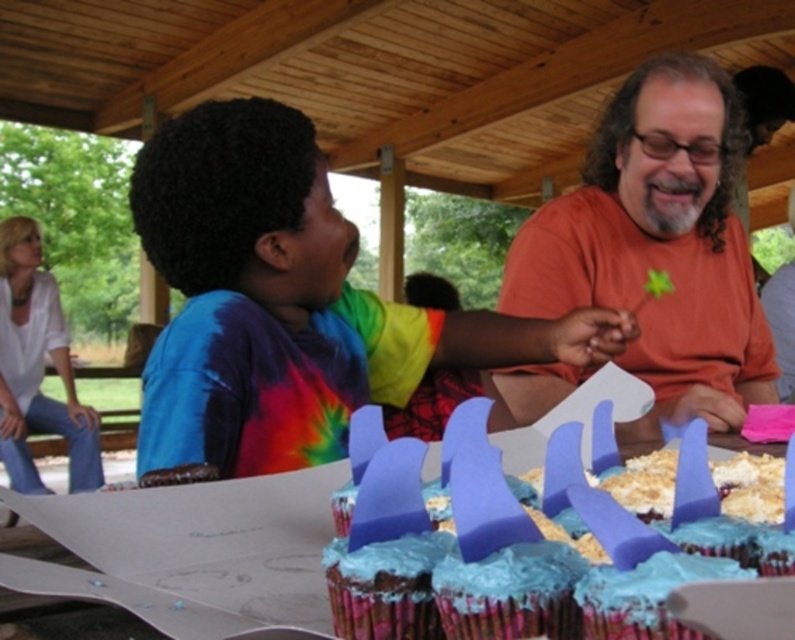
Is orange matte shirt at center in front of blue foam shark fin at center?

No.

Image resolution: width=795 pixels, height=640 pixels. I want to click on orange matte shirt at center, so click(658, 244).

Where is `orange matte shirt at center`? This screenshot has height=640, width=795. orange matte shirt at center is located at coordinates (658, 244).

Where is `orange matte shirt at center`? The height and width of the screenshot is (640, 795). orange matte shirt at center is located at coordinates (658, 244).

Is tie-dye shirt at left wider than orange matte shirt at center?

Yes.

Between tie-dye shirt at left and orange matte shirt at center, which one has less height?

With less height is tie-dye shirt at left.

Between point (272, 460) and point (602, 156), which one is positioned behind?

The point (602, 156) is behind.

In order to click on tie-dye shirt at left in this screenshot , I will do `click(254, 289)`.

Can you confirm if tie-dye shirt at left is positioned to the right of blue foam shark fin at center?

No, tie-dye shirt at left is not to the right of blue foam shark fin at center.

Image resolution: width=795 pixels, height=640 pixels. What do you see at coordinates (254, 289) in the screenshot?
I see `tie-dye shirt at left` at bounding box center [254, 289].

What do you see at coordinates (254, 289) in the screenshot? Image resolution: width=795 pixels, height=640 pixels. I see `tie-dye shirt at left` at bounding box center [254, 289].

This screenshot has height=640, width=795. Find the location of `tie-dye shirt at left`. tie-dye shirt at left is located at coordinates (254, 289).